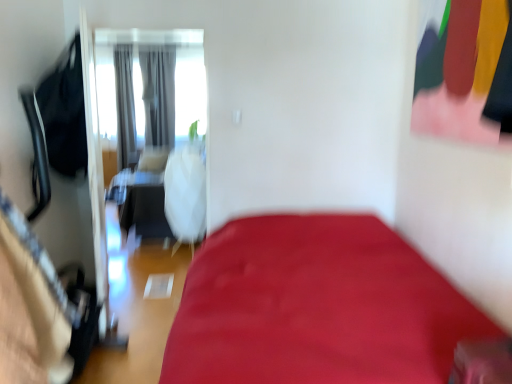
I want to click on vacant space situated above white matte screen door at upper left (from a real-world perspective), so pos(141,25).